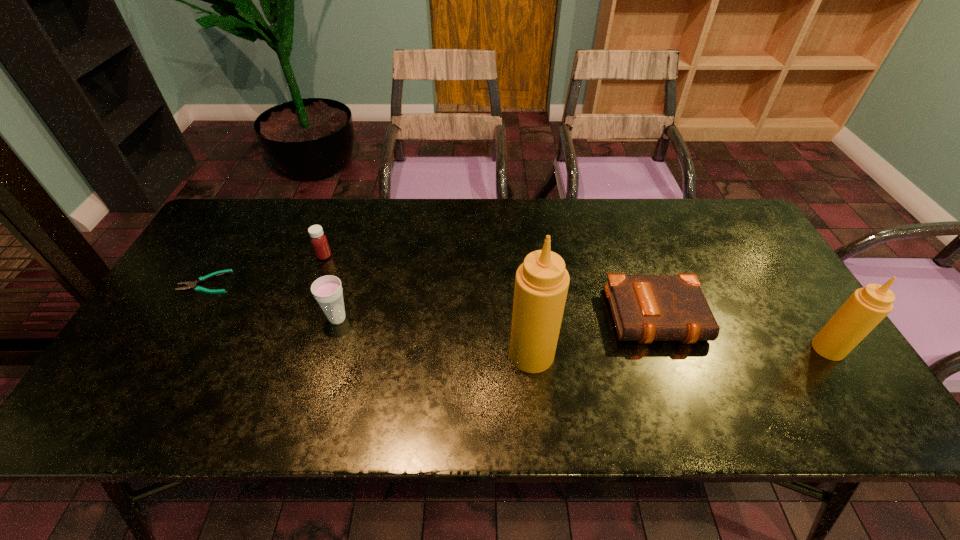
Locate an element on the screen. This screenshot has height=540, width=960. free space between the fourth object from right to left and the Bible is located at coordinates (x=499, y=318).

Image resolution: width=960 pixels, height=540 pixels. Find the location of `empty location between the left condiment and the third object from left to right`. empty location between the left condiment and the third object from left to right is located at coordinates (435, 336).

What are the coordinates of `blank region between the pliers and the fifth tallest object` in the screenshot? It's located at (433, 300).

Locate an element on the screen. vacant space that is in between the fifth object from left to right and the pliers is located at coordinates (433, 300).

The width and height of the screenshot is (960, 540). Identify the location of object that ranks as the fifth closest to the pliers. (866, 307).

Choose which object is the fourth nearest neighbor to the shortest object. Please provide its 2D coordinates. Your answer should be formatted as a tuple, i.e. [(x, y)], where the tuple contains the x and y coordinates of a point satisfying the conditions above.

[(645, 308)]

Where is `free location that satisfies the following two spatial constraints: 1. on the front side of the fourth shortest object; 2. on the right side of the second tallest object`? The height and width of the screenshot is (540, 960). free location that satisfies the following two spatial constraints: 1. on the front side of the fourth shortest object; 2. on the right side of the second tallest object is located at coordinates (329, 348).